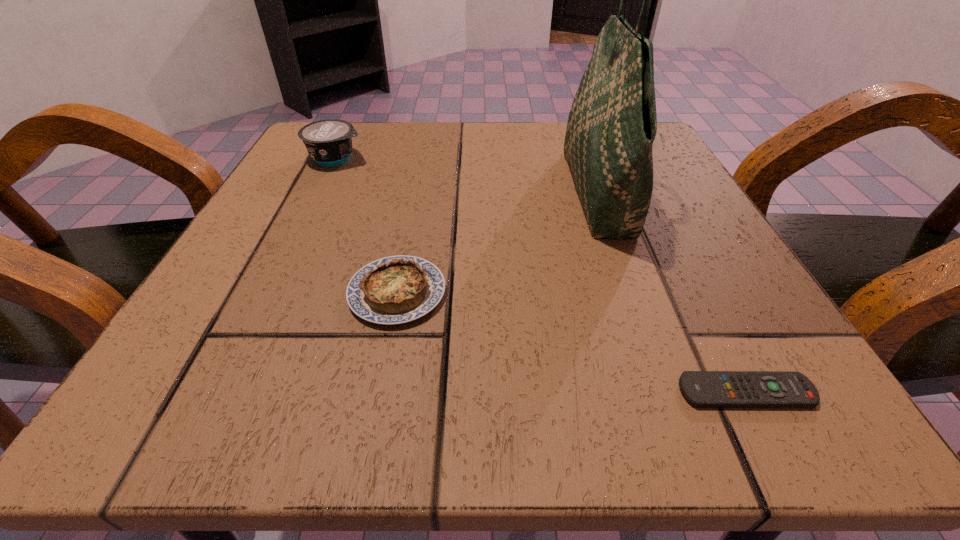
Locate an element on the screen. This screenshot has width=960, height=540. free area in between the tallest object and the shortest object is located at coordinates (672, 293).

Where is `free space between the leftmost object and the remote control`? The height and width of the screenshot is (540, 960). free space between the leftmost object and the remote control is located at coordinates (541, 275).

The width and height of the screenshot is (960, 540). I want to click on vacant space that's between the nearest object and the yogurt, so click(541, 275).

Find the location of a particular element. empty space between the third shortest object and the shortest object is located at coordinates (541, 275).

This screenshot has height=540, width=960. What are the coordinates of `free spot between the shortest object and the third shortest object` in the screenshot? It's located at (541, 275).

Locate an element on the screen. free point between the third farthest object and the leftmost object is located at coordinates click(x=367, y=226).

Where is `object that can be found as the second closest to the tote bag`? object that can be found as the second closest to the tote bag is located at coordinates (704, 389).

Identify which object is located as the nearest to the leftmost object. Please provide its 2D coordinates. Your answer should be formatted as a tuple, i.e. [(x, y)], where the tuple contains the x and y coordinates of a point satisfying the conditions above.

[(397, 289)]

Find the location of a particular element. The image size is (960, 540). blank area in the image that satisfies the following two spatial constraints: 1. on the front side of the remote control; 2. on the left side of the yogurt is located at coordinates (222, 392).

At what (x,y) coordinates should I click in order to perform the action: click on free point that satisfies the following two spatial constraints: 1. on the front side of the shortest object; 2. on the right side of the tallest object. Please return your answer as a coordinate pair (x, y). The height and width of the screenshot is (540, 960). Looking at the image, I should click on (670, 392).